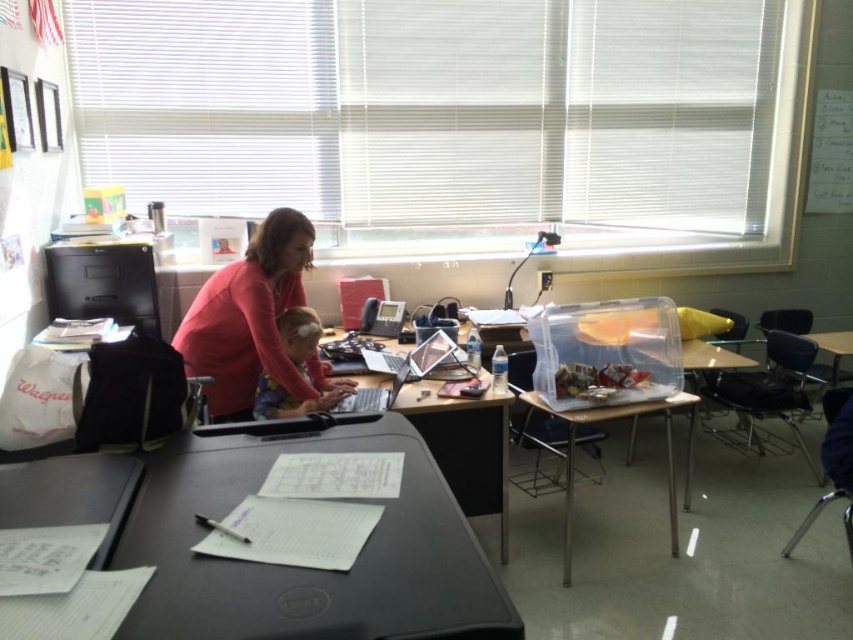
Question: Does matte pink sweater at center appear under matte plastic laptop at center?

Choices:
 (A) yes
 (B) no

Answer: (B)

Question: Does clear plastic container at center lie behind matte plastic laptop at center?

Choices:
 (A) no
 (B) yes

Answer: (B)

Question: Which point is farther to the camera?

Choices:
 (A) (309, 392)
 (B) (679, 394)
 (C) (436, 461)

Answer: (B)

Question: Is black plastic table at center in front of matte black laptop at center?

Choices:
 (A) no
 (B) yes

Answer: (B)

Question: Based on their relative distances, which object is nearer to the clear plastic container at center?

Choices:
 (A) matte black laptop at center
 (B) black plastic table at center
 (C) matte pink sweater at center
 (D) matte plastic laptop at center

Answer: (A)

Question: Among these points, which one is farthest from the camera?

Choices:
 (A) (302, 444)
 (B) (329, 390)
 (C) (207, 289)
 (D) (564, 563)

Answer: (C)